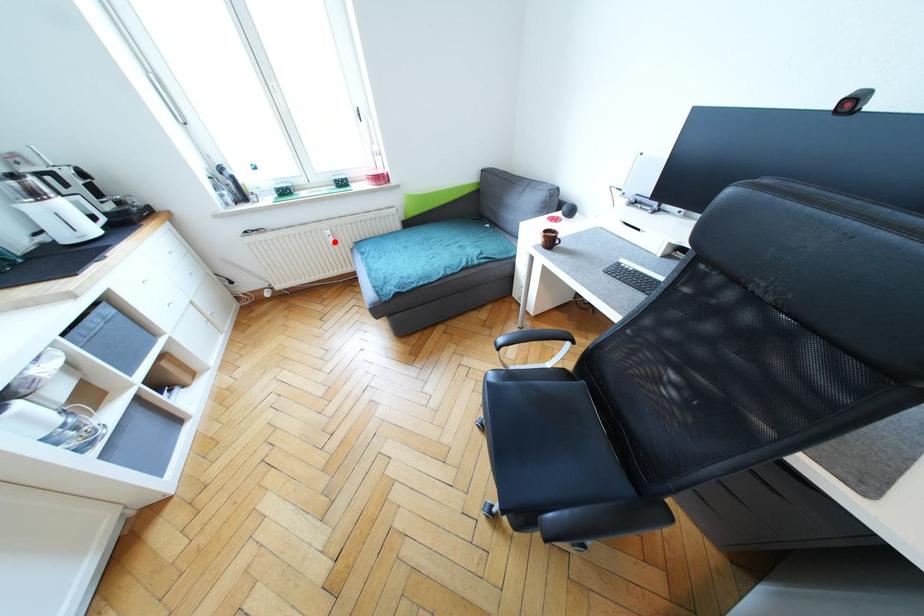
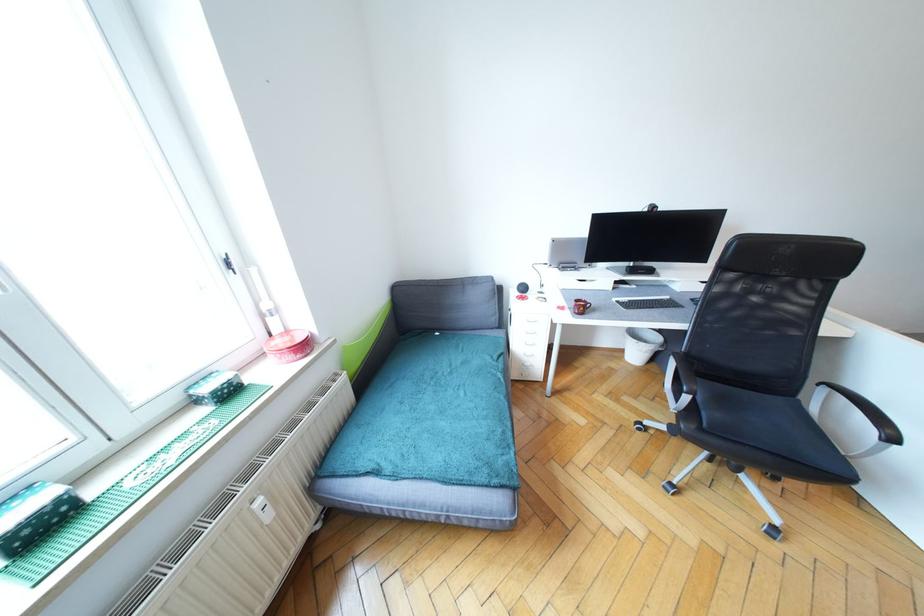
The point at the highlighted location is marked in the first image. Where is the corresponding point in the second image?

(272, 517)